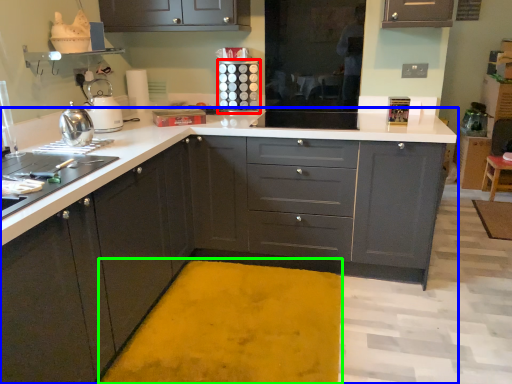
Question: Considering the real-world distances, which object is closest to appliance (highlighted by a red box)? countertop (highlighted by a blue box) or bath mat (highlighted by a green box).

Choices:
 (A) countertop
 (B) bath mat

Answer: (A)